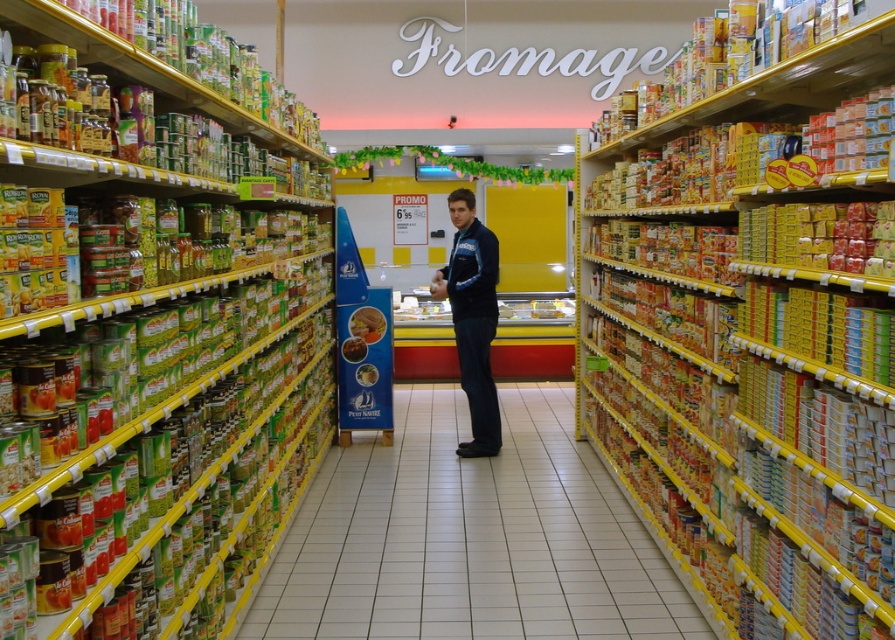
Describe the element at coordinates (152, 360) in the screenshot. I see `metallic cans at left` at that location.

Is point (311, 307) behind point (348, 360)?

That is False.

Does point (181, 268) come farther from viewer compared to point (347, 353)?

That is False.

Where is `metallic cans at left`? metallic cans at left is located at coordinates (152, 360).

Does green matte cans at center lie behind matte plastic container at center?

No, green matte cans at center is closer to the viewer.

Is green matte cans at center above matte plastic container at center?

Incorrect, green matte cans at center is not positioned above matte plastic container at center.

What do you see at coordinates (470, 538) in the screenshot?
I see `green matte cans at center` at bounding box center [470, 538].

Locate an element on the screen. green matte cans at center is located at coordinates (470, 538).

Does metallic cans at left have a lesser width compared to green matte cans at center?

Yes, metallic cans at left is thinner than green matte cans at center.

Does metallic cans at left come in front of green matte cans at center?

Yes.

Does point (135, 625) come closer to viewer compared to point (631, 564)?

Yes, it is.

Identify the location of metallic cans at left. The height and width of the screenshot is (640, 895). (152, 360).